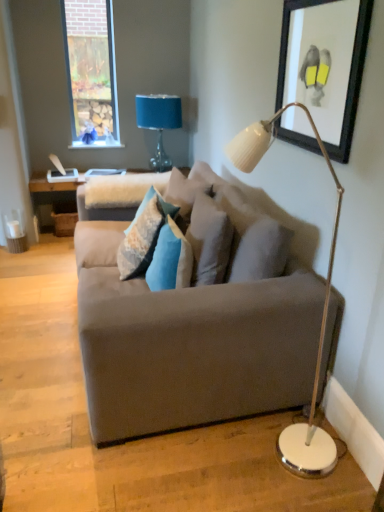
How much space does textured blue pillow at center, the 1th pillow when ordered from left to right, occupy vertically?

It is 17.09 inches.

Find the location of a particular element. textured blue pillow at center, the 1th pillow when ordered from left to right is located at coordinates (143, 234).

What do you see at coordinates (159, 122) in the screenshot?
I see `blue fabric lampshade at upper center` at bounding box center [159, 122].

Describe the element at coordinates (323, 307) in the screenshot. I see `white glossy floor lamp at right` at that location.

Find the location of a particular element. This screenshot has width=384, height=512. white glossy floor lamp at right is located at coordinates (323, 307).

What are the coordinates of `suede gray couch at center` in the screenshot? It's located at (197, 324).

At what (x,y) coordinates should I click in order to perform the action: click on textured blue pillow at center, which ranks as the third pillow in right-to-left order. Please return your answer as a coordinate pair (x, y). Looking at the image, I should click on (143, 234).

Does textured blue pillow at center, which ranks as the third pillow in right-to-left order, have a larger size compared to blue fabric lampshade at upper center?

Actually, textured blue pillow at center, which ranks as the third pillow in right-to-left order, might be smaller than blue fabric lampshade at upper center.

Considering the relative sizes of textured blue pillow at center, the 1th pillow when ordered from left to right, and blue fabric lampshade at upper center in the image provided, is textured blue pillow at center, the 1th pillow when ordered from left to right, taller than blue fabric lampshade at upper center?

No, textured blue pillow at center, the 1th pillow when ordered from left to right, is not taller than blue fabric lampshade at upper center.

Are textured blue pillow at center, which ranks as the third pillow in right-to-left order, and blue fabric lampshade at upper center making contact?

No, textured blue pillow at center, which ranks as the third pillow in right-to-left order, is not in contact with blue fabric lampshade at upper center.

Is blue fabric lampshade at upper center directly adjacent to textured blue pillow at center, the 1th pillow when ordered from left to right?

No, blue fabric lampshade at upper center is not touching textured blue pillow at center, the 1th pillow when ordered from left to right.

How different are the orientations of blue fabric lampshade at upper center and textured blue pillow at center, which ranks as the third pillow in right-to-left order, in degrees?

The angle between the facing direction of blue fabric lampshade at upper center and the facing direction of textured blue pillow at center, which ranks as the third pillow in right-to-left order, is 90.4 degrees.

Which is more to the left, blue fabric lampshade at upper center or textured blue pillow at center, which ranks as the third pillow in right-to-left order?

textured blue pillow at center, which ranks as the third pillow in right-to-left order.

Considering the sizes of objects blue fabric lampshade at upper center and textured blue pillow at center, the 1th pillow when ordered from left to right, in the image provided, who is bigger, blue fabric lampshade at upper center or textured blue pillow at center, the 1th pillow when ordered from left to right,?

blue fabric lampshade at upper center is bigger.

Which is more to the left, blue fabric lampshade at upper center or black matte picture frame at upper right?

From the viewer's perspective, blue fabric lampshade at upper center appears more on the left side.

Is blue fabric lampshade at upper center facing towards black matte picture frame at upper right?

Yes, blue fabric lampshade at upper center is oriented towards black matte picture frame at upper right.

Between blue fabric lampshade at upper center and black matte picture frame at upper right, which one has smaller width?

With smaller width is black matte picture frame at upper right.

From a real-world perspective, who is located lower, blue fabric lampshade at upper center or black matte picture frame at upper right?

blue fabric lampshade at upper center.

How many degrees apart are the facing directions of black matte picture frame at upper right and blue velvet pillow at center, arranged as the 2th pillow when viewed from the left?

The angular difference between black matte picture frame at upper right and blue velvet pillow at center, arranged as the 2th pillow when viewed from the left, is 4.86 degrees.

Considering the sizes of black matte picture frame at upper right and blue velvet pillow at center, arranged as the 2th pillow when viewed from the left, in the image, is black matte picture frame at upper right bigger or smaller than blue velvet pillow at center, arranged as the 2th pillow when viewed from the left,?

black matte picture frame at upper right is smaller than blue velvet pillow at center, arranged as the 2th pillow when viewed from the left.

From the image's perspective, between black matte picture frame at upper right and blue velvet pillow at center, arranged as the 2th pillow when viewed from the left, who is located below?

From the image's view, blue velvet pillow at center, arranged as the 2th pillow when viewed from the left, is below.

Considering the sizes of objects textured gray pillow at center, which appears as the 3th pillow when viewed from the left, and black matte picture frame at upper right in the image provided, who is shorter, textured gray pillow at center, which appears as the 3th pillow when viewed from the left, or black matte picture frame at upper right?

With less height is textured gray pillow at center, which appears as the 3th pillow when viewed from the left.

Is textured gray pillow at center, which appears as the 3th pillow when viewed from the left, bigger or smaller than black matte picture frame at upper right?

Considering their sizes, textured gray pillow at center, which appears as the 3th pillow when viewed from the left, takes up more space than black matte picture frame at upper right.

Is textured gray pillow at center, which appears as the 3th pillow when viewed from the left, thinner than black matte picture frame at upper right?

In fact, textured gray pillow at center, which appears as the 3th pillow when viewed from the left, might be wider than black matte picture frame at upper right.

Based on the photo, is textured gray pillow at center, which appears as the 3th pillow when viewed from the left, touching black matte picture frame at upper right?

No, textured gray pillow at center, which appears as the 3th pillow when viewed from the left, is not with black matte picture frame at upper right.

In terms of height, does blue velvet pillow at center, which is the 2th pillow from right to left, look taller or shorter compared to textured gray pillow at center, which appears as the 3th pillow when viewed from the left?

Clearly, blue velvet pillow at center, which is the 2th pillow from right to left, is shorter compared to textured gray pillow at center, which appears as the 3th pillow when viewed from the left.

Considering the positions of objects blue velvet pillow at center, arranged as the 2th pillow when viewed from the left, and textured gray pillow at center, which appears as the 3th pillow when viewed from the left, in the image provided, who is behind, blue velvet pillow at center, arranged as the 2th pillow when viewed from the left, or textured gray pillow at center, which appears as the 3th pillow when viewed from the left,?

textured gray pillow at center, which appears as the 3th pillow when viewed from the left, is further away from the camera.

Based on the photo, is textured gray pillow at center, which appears as the 3th pillow when viewed from the left, located within blue velvet pillow at center, which is the 2th pillow from right to left?

Actually, textured gray pillow at center, which appears as the 3th pillow when viewed from the left, is outside blue velvet pillow at center, which is the 2th pillow from right to left.

From a real-world perspective, starting from the textured gray pillow at center, which appears as the 3th pillow when viewed from the left, which pillow is the 2nd one below it? Please provide its 2D coordinates.

[(170, 259)]

Are textured gray pillow at center, the first pillow in the right-to-left sequence, and blue fabric lampshade at upper center far apart?

Indeed, textured gray pillow at center, the first pillow in the right-to-left sequence, is not near blue fabric lampshade at upper center.

In the image, there is a textured gray pillow at center, which appears as the 3th pillow when viewed from the left. Identify the location of table lamp above it (from the image's perspective). (159, 122).

Is textured gray pillow at center, which appears as the 3th pillow when viewed from the left, bigger than blue fabric lampshade at upper center?

No.

How many degrees apart are the facing directions of textured gray pillow at center, which appears as the 3th pillow when viewed from the left, and blue fabric lampshade at upper center?

90.4 degrees separate the facing orientations of textured gray pillow at center, which appears as the 3th pillow when viewed from the left, and blue fabric lampshade at upper center.

Find the location of `pillow that is the 1st one when counting forward from the blue fabric lampshade at upper center`. pillow that is the 1st one when counting forward from the blue fabric lampshade at upper center is located at coordinates (143, 234).

This screenshot has height=512, width=384. I want to click on the 1st pillow positioned below the blue fabric lampshade at upper center (from the image's perspective), so click(x=143, y=234).

Estimate the real-world distances between objects in this image. Which object is closer to white glossy floor lamp at right, suede gray couch at center or textured gray pillow at center, the first pillow in the right-to-left sequence?

Based on the image, suede gray couch at center appears to be nearer to white glossy floor lamp at right.

Considering their positions, is white glossy floor lamp at right positioned further to blue velvet pillow at center, which is the 2th pillow from right to left, than blue fabric lampshade at upper center?

blue fabric lampshade at upper center lies further to blue velvet pillow at center, which is the 2th pillow from right to left, than the other object.

Which object lies further to the anchor point black matte picture frame at upper right, textured blue pillow at center, the 1th pillow when ordered from left to right, or white glossy floor lamp at right?

textured blue pillow at center, the 1th pillow when ordered from left to right, lies further to black matte picture frame at upper right than the other object.

Considering their positions, is textured gray pillow at center, which appears as the 3th pillow when viewed from the left, positioned closer to textured blue pillow at center, which ranks as the third pillow in right-to-left order, than blue velvet pillow at center, which is the 2th pillow from right to left?

blue velvet pillow at center, which is the 2th pillow from right to left, is closer to textured blue pillow at center, which ranks as the third pillow in right-to-left order.

When comparing their distances from textured gray pillow at center, which appears as the 3th pillow when viewed from the left, does textured blue pillow at center, which ranks as the third pillow in right-to-left order, or black matte picture frame at upper right seem closer?

The object closer to textured gray pillow at center, which appears as the 3th pillow when viewed from the left, is textured blue pillow at center, which ranks as the third pillow in right-to-left order.

Considering their positions, is suede gray couch at center positioned further to black matte picture frame at upper right than textured gray pillow at center, which appears as the 3th pillow when viewed from the left?

suede gray couch at center is positioned further to the anchor black matte picture frame at upper right.

Based on their spatial positions, is suede gray couch at center or blue fabric lampshade at upper center further from blue velvet pillow at center, which is the 2th pillow from right to left?

blue fabric lampshade at upper center lies further to blue velvet pillow at center, which is the 2th pillow from right to left, than the other object.

In the scene shown: When comparing their distances from blue fabric lampshade at upper center, does textured gray pillow at center, the first pillow in the right-to-left sequence, or black matte picture frame at upper right seem closer?

Based on the image, textured gray pillow at center, the first pillow in the right-to-left sequence, appears to be nearer to blue fabric lampshade at upper center.

Locate an element on the screen. studio couch between black matte picture frame at upper right and blue velvet pillow at center, which is the 2th pillow from right to left, in the up-down direction is located at coordinates (197, 324).

You are a GUI agent. You are given a task and a screenshot of the screen. Output one action in this format:
    pyautogui.click(x=<x>, y=<y>)
    Task: Click on the studio couch located between white glossy floor lamp at right and textured blue pillow at center, the 1th pillow when ordered from left to right, in the depth direction
    This screenshot has width=384, height=512.
    Given the screenshot: What is the action you would take?
    pyautogui.click(x=197, y=324)

This screenshot has width=384, height=512. Identify the location of studio couch between white glossy floor lamp at right and blue velvet pillow at center, arranged as the 2th pillow when viewed from the left, along the z-axis. (197, 324).

This screenshot has height=512, width=384. What are the coordinates of `picture frame between white glossy floor lamp at right and textured blue pillow at center, the 1th pillow when ordered from left to right, from front to back` in the screenshot? It's located at (327, 64).